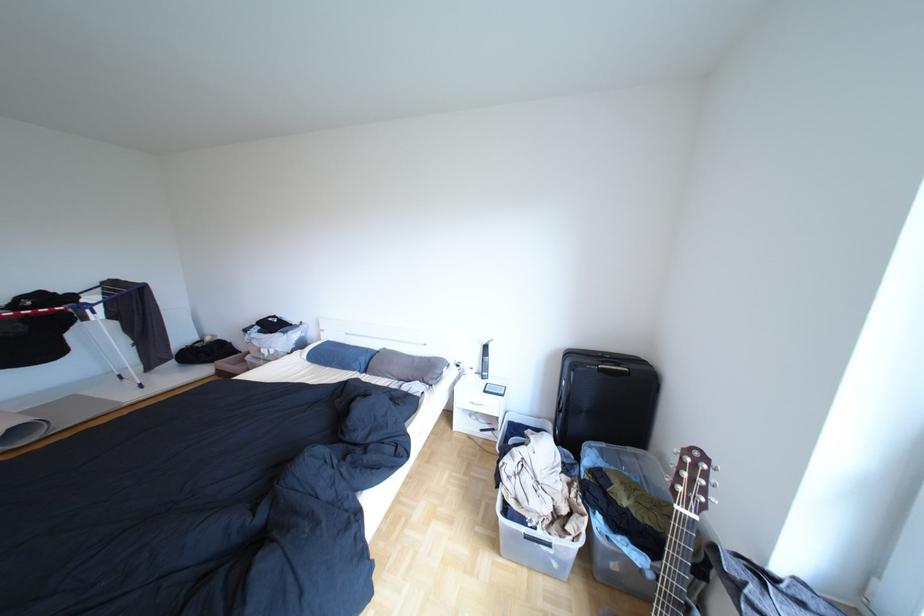
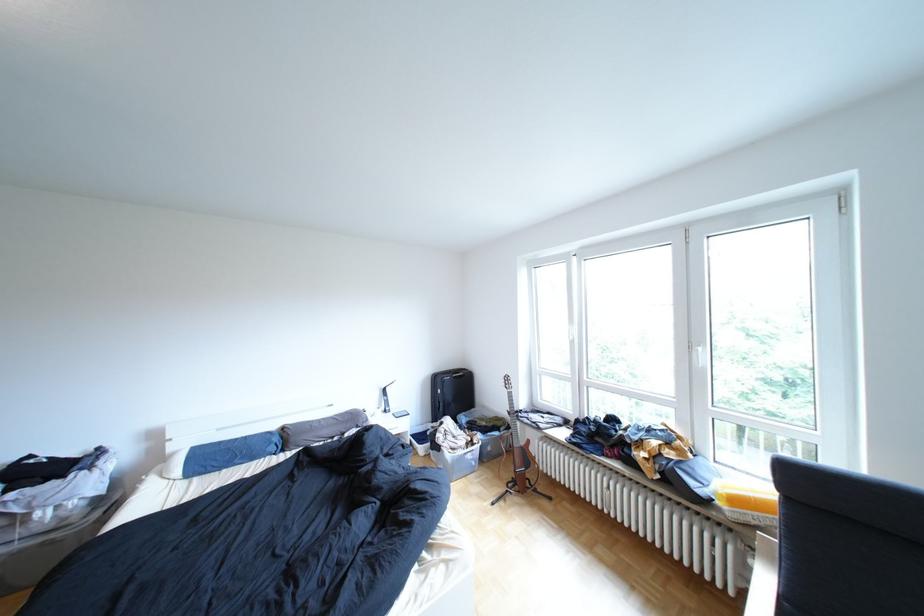
Find the pixel in the second image that matches point (540, 504) in the first image.

(470, 446)